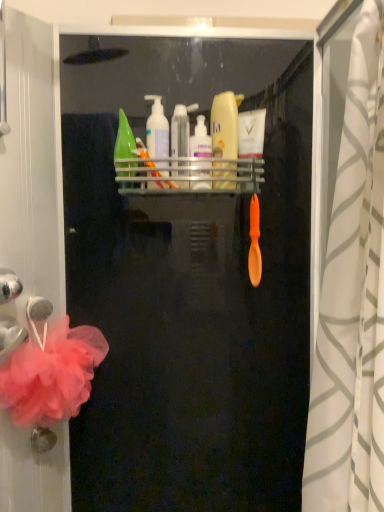
Describe the element at coordinates (250, 144) in the screenshot. I see `white matte cream at upper center, the fourth toiletry when ordered from left to right` at that location.

This screenshot has width=384, height=512. Describe the element at coordinates (124, 147) in the screenshot. I see `green plastic spray bottle at upper center, which appears as the 1th cleaning product when viewed from the left` at that location.

Measure the distance between point [21,348] and camera.

33.86 inches.

Where is `white plastic pump bottle at upper center, marked as the second toiletry in a right-to-left arrangement`? This screenshot has width=384, height=512. white plastic pump bottle at upper center, marked as the second toiletry in a right-to-left arrangement is located at coordinates (200, 156).

Describe the element at coordinates (352, 300) in the screenshot. I see `white textured shower curtain at right` at that location.

What is the approximate width of metallic silver towel bar at left?

It is 1.61 inches.

How much space does white matte pump bottle at upper center, acting as the first toiletry starting from the left, occupy horizontally?

It is 3.88 inches.

Find the location of `white matte pump bottle at upper center, which is the 4th toiletry from right to left`. white matte pump bottle at upper center, which is the 4th toiletry from right to left is located at coordinates (157, 130).

Find the location of `white matte cream at upper center, the 1th toiletry from the right`. white matte cream at upper center, the 1th toiletry from the right is located at coordinates (x=250, y=144).

Which object is positioned more to the right, white matte pump bottle at upper center, acting as the first toiletry starting from the left, or transparent plastic screen door at upper center?

From the viewer's perspective, transparent plastic screen door at upper center appears more on the right side.

Is white matte pump bottle at upper center, which is the 4th toiletry from right to left, positioned far away from transparent plastic screen door at upper center?

No, white matte pump bottle at upper center, which is the 4th toiletry from right to left, is not far from transparent plastic screen door at upper center.

Which of these two, white matte pump bottle at upper center, which is the 4th toiletry from right to left, or transparent plastic screen door at upper center, is wider?

With larger width is transparent plastic screen door at upper center.

How many degrees apart are the facing directions of white matte pump bottle at upper center, acting as the first toiletry starting from the left, and transparent plastic screen door at upper center?

The angular difference between white matte pump bottle at upper center, acting as the first toiletry starting from the left, and transparent plastic screen door at upper center is 3.4 degrees.

Where is `towel bar on the left of the white textured shower curtain at right`? towel bar on the left of the white textured shower curtain at right is located at coordinates (38, 308).

Based on the photo, is white textured shower curtain at right taller than metallic silver towel bar at left?

Yes, white textured shower curtain at right is taller than metallic silver towel bar at left.

Is white textured shower curtain at right directly adjacent to metallic silver towel bar at left?

white textured shower curtain at right and metallic silver towel bar at left are not in contact.

Based on their positions, is pink tulle bath towel at left located to the left or right of white matte cream at upper center, the fourth toiletry when ordered from left to right?

From the image, it's evident that pink tulle bath towel at left is to the left of white matte cream at upper center, the fourth toiletry when ordered from left to right.

What are the coordinates of `bath towel below the white matte cream at upper center, the fourth toiletry when ordered from left to right (from a real-world perspective)` in the screenshot? It's located at (52, 375).

Which of these two, pink tulle bath towel at left or white matte cream at upper center, the fourth toiletry when ordered from left to right, stands taller?

pink tulle bath towel at left.

Is pink tulle bath towel at left turned away from white matte cream at upper center, the fourth toiletry when ordered from left to right?

No.

In the scene shown: Which object is positioned more to the right, transparent plastic screen door at upper center or pink tulle bath towel at left?

From the viewer's perspective, transparent plastic screen door at upper center appears more on the right side.

Considering the sizes of objects transparent plastic screen door at upper center and pink tulle bath towel at left in the image provided, who is thinner, transparent plastic screen door at upper center or pink tulle bath towel at left?

pink tulle bath towel at left is thinner.

Based on the photo, considering the sizes of transparent plastic screen door at upper center and pink tulle bath towel at left in the image, is transparent plastic screen door at upper center taller or shorter than pink tulle bath towel at left?

transparent plastic screen door at upper center is taller than pink tulle bath towel at left.

Could you tell me if transparent plastic screen door at upper center is turned towards pink tulle bath towel at left?

No, transparent plastic screen door at upper center does not turn towards pink tulle bath towel at left.

Based on the photo, does metallic silver towel bar at left appear on the left side of white textured shower curtain at right?

Yes, metallic silver towel bar at left is to the left of white textured shower curtain at right.

Considering the relative sizes of metallic silver towel bar at left and white textured shower curtain at right in the image provided, is metallic silver towel bar at left thinner than white textured shower curtain at right?

Correct, the width of metallic silver towel bar at left is less than that of white textured shower curtain at right.

The image size is (384, 512). I want to click on towel bar below the white textured shower curtain at right (from a real-world perspective), so click(38, 308).

In the scene shown: From a real-world perspective, is metallic silver towel bar at left over white textured shower curtain at right?

Incorrect, from a real-world perspective, metallic silver towel bar at left is lower than white textured shower curtain at right.

Who is shorter, metallic silver shelf at upper center or transparent plastic tube at center, arranged as the 3th toiletry when viewed from the right?

With less height is metallic silver shelf at upper center.

Choose the correct answer: Is metallic silver shelf at upper center inside transparent plastic tube at center, arranged as the 3th toiletry when viewed from the right, or outside it?

metallic silver shelf at upper center cannot be found inside transparent plastic tube at center, arranged as the 3th toiletry when viewed from the right.

Considering their positions, is metallic silver shelf at upper center located in front of or behind transparent plastic tube at center, positioned as the second toiletry in left-to-right order?

metallic silver shelf at upper center is positioned closer to the viewer than transparent plastic tube at center, positioned as the second toiletry in left-to-right order.

How different are the orientations of metallic silver shelf at upper center and transparent plastic tube at center, arranged as the 3th toiletry when viewed from the right, in degrees?

The facing directions of metallic silver shelf at upper center and transparent plastic tube at center, arranged as the 3th toiletry when viewed from the right, are 0.000184 degrees apart.

Considering the positions of objects white textured shower curtain at right and white matte pump bottle at upper center, acting as the first toiletry starting from the left, in the image provided, who is more to the left, white textured shower curtain at right or white matte pump bottle at upper center, acting as the first toiletry starting from the left,?

Positioned to the left is white matte pump bottle at upper center, acting as the first toiletry starting from the left.

Is white textured shower curtain at right located outside white matte pump bottle at upper center, acting as the first toiletry starting from the left?

Yes, white textured shower curtain at right is outside of white matte pump bottle at upper center, acting as the first toiletry starting from the left.

Can you see white textured shower curtain at right touching white matte pump bottle at upper center, which is the 4th toiletry from right to left?

No, white textured shower curtain at right is not touching white matte pump bottle at upper center, which is the 4th toiletry from right to left.

Is white textured shower curtain at right bigger than white matte pump bottle at upper center, which is the 4th toiletry from right to left?

Correct, white textured shower curtain at right is larger in size than white matte pump bottle at upper center, which is the 4th toiletry from right to left.

This screenshot has height=512, width=384. Identify the location of toiletry that is the 4th object above the transparent plastic screen door at upper center (from a real-world perspective). (157, 130).

Locate an element on the screen. This screenshot has height=512, width=384. shower curtain lying in front of the metallic silver towel bar at left is located at coordinates (352, 300).

Estimate the real-world distances between objects in this image. Which object is closer to white matte cream at upper center, the 1th toiletry from the right, yellow matte bottle at upper center, the second cleaning product from the left, or metallic silver towel bar at left?

yellow matte bottle at upper center, the second cleaning product from the left.

Estimate the real-world distances between objects in this image. Which object is closer to yellow matte bottle at upper center, the second cleaning product from the left, white matte cream at upper center, the fourth toiletry when ordered from left to right, or transparent plastic screen door at upper center?

white matte cream at upper center, the fourth toiletry when ordered from left to right, is positioned closer to the anchor yellow matte bottle at upper center, the second cleaning product from the left.

Considering their positions, is metallic silver shelf at upper center positioned further to transparent plastic tube at center, positioned as the second toiletry in left-to-right order, than transparent plastic screen door at upper center?

transparent plastic screen door at upper center.

Which object lies nearer to the anchor point white matte pump bottle at upper center, which is the 4th toiletry from right to left, transparent plastic screen door at upper center or transparent plastic tube at center, arranged as the 3th toiletry when viewed from the right?

transparent plastic tube at center, arranged as the 3th toiletry when viewed from the right, is positioned closer to the anchor white matte pump bottle at upper center, which is the 4th toiletry from right to left.

From the image, which object appears to be nearer to metallic silver shelf at upper center, white plastic pump bottle at upper center, marked as the second toiletry in a right-to-left arrangement, or transparent plastic tube at center, arranged as the 3th toiletry when viewed from the right?

white plastic pump bottle at upper center, marked as the second toiletry in a right-to-left arrangement.

Based on their spatial positions, is white plastic pump bottle at upper center, marked as the second toiletry in a right-to-left arrangement, or pink tulle bath towel at left closer to white textured shower curtain at right?

The object closer to white textured shower curtain at right is white plastic pump bottle at upper center, marked as the second toiletry in a right-to-left arrangement.

Based on the photo, which object lies further to the anchor point white plastic pump bottle at upper center, marked as the second toiletry in a right-to-left arrangement, pink tulle bath towel at left or transparent plastic screen door at upper center?

The object further to white plastic pump bottle at upper center, marked as the second toiletry in a right-to-left arrangement, is pink tulle bath towel at left.

When comparing their distances from transparent plastic screen door at upper center, does transparent plastic tube at center, arranged as the 3th toiletry when viewed from the right, or metallic silver towel bar at left seem further?

The object further to transparent plastic screen door at upper center is metallic silver towel bar at left.

Locate an element on the screen. Image resolution: width=384 pixels, height=512 pixels. shelf situated between metallic silver towel bar at left and yellow matte bottle at upper center, the second cleaning product from the left, from left to right is located at coordinates tap(192, 175).

Find the location of `cleaning product between transparent plastic screen door at upper center and white plastic pump bottle at upper center, positioned as the 3th toiletry in left-to-right order, along the z-axis`. cleaning product between transparent plastic screen door at upper center and white plastic pump bottle at upper center, positioned as the 3th toiletry in left-to-right order, along the z-axis is located at coordinates (124, 147).

Where is `toiletry situated between metallic silver shelf at upper center and white matte cream at upper center, the 1th toiletry from the right, from left to right`? toiletry situated between metallic silver shelf at upper center and white matte cream at upper center, the 1th toiletry from the right, from left to right is located at coordinates (200, 156).

Find the location of `bath towel located between white textured shower curtain at right and transparent plastic tube at center, positioned as the second toiletry in left-to-right order, in the depth direction`. bath towel located between white textured shower curtain at right and transparent plastic tube at center, positioned as the second toiletry in left-to-right order, in the depth direction is located at coordinates (52, 375).